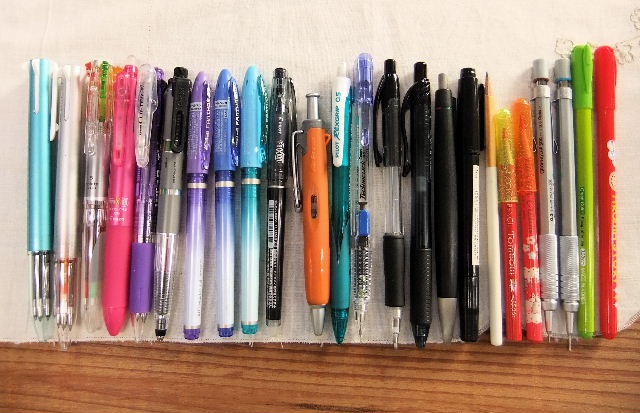
This screenshot has width=640, height=413. Identify the location of orange pens. (317, 256), (120, 288), (518, 289), (525, 298).